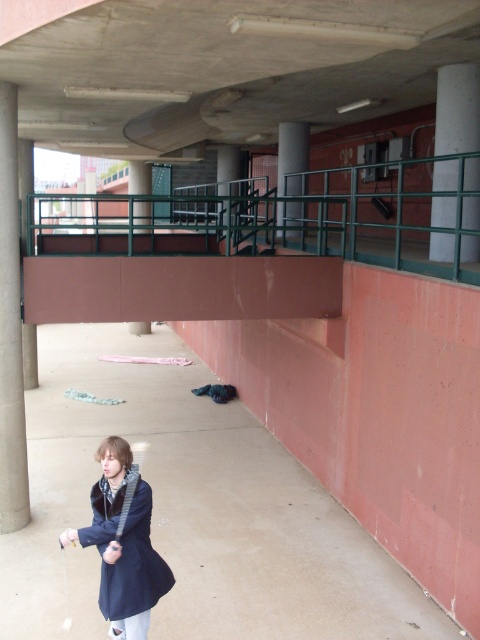
Question: Is concrete pillar at left further to the viewer compared to brown concrete pillar at center?

Choices:
 (A) no
 (B) yes

Answer: (A)

Question: Is smooth concrete pillar at center further to camera compared to brown concrete pillar at center?

Choices:
 (A) no
 (B) yes

Answer: (B)

Question: Estimate the real-world distances between objects in this image. Which object is farther from the concrete pillar at left?

Choices:
 (A) smooth concrete pillar at center
 (B) brown concrete pillar at center

Answer: (B)

Question: Does dark blue woolen jacket at lower left have a smaller size compared to brown concrete pillar at center?

Choices:
 (A) no
 (B) yes

Answer: (B)

Question: Which object is positioned farthest from the concrete at right?

Choices:
 (A) dark blue woolen jacket at lower left
 (B) smooth concrete pillar at center

Answer: (A)

Question: Which point is closer to the camera taking this photo?

Choices:
 (A) (136, 182)
 (B) (59, 520)

Answer: (B)